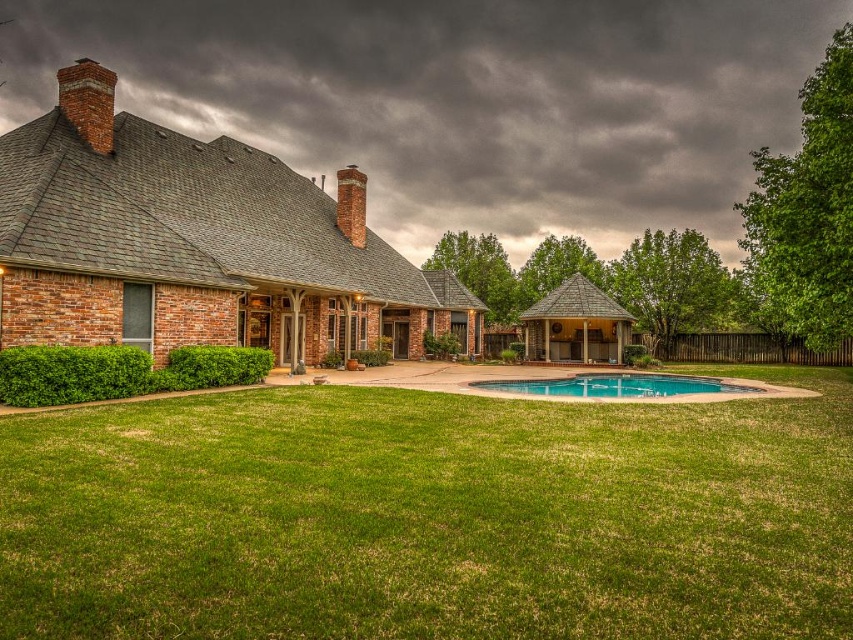
Which is in front, point (722, 563) or point (751, 60)?

Point (722, 563)

The height and width of the screenshot is (640, 853). Describe the element at coordinates (431, 516) in the screenshot. I see `green grass at center` at that location.

Which is behind, point (825, 432) or point (560, 10)?

Point (560, 10)

Where is `green grass at center`? The image size is (853, 640). green grass at center is located at coordinates (431, 516).

Does dark gray shingles at upper center appear on the right side of clear blue water at center?

No, dark gray shingles at upper center is not to the right of clear blue water at center.

Is dark gray shingles at upper center smaller than clear blue water at center?

No, dark gray shingles at upper center is not smaller than clear blue water at center.

Does point (387, 65) lie in front of point (685, 392)?

No.

Where is `dark gray shingles at upper center`? This screenshot has height=640, width=853. dark gray shingles at upper center is located at coordinates (461, 99).

Does green grass at center appear under clear blue water at center?

Actually, green grass at center is above clear blue water at center.

Between green grass at center and clear blue water at center, which one is positioned lower?

clear blue water at center is lower down.

What do you see at coordinates (431, 516) in the screenshot? Image resolution: width=853 pixels, height=640 pixels. I see `green grass at center` at bounding box center [431, 516].

I want to click on green grass at center, so click(431, 516).